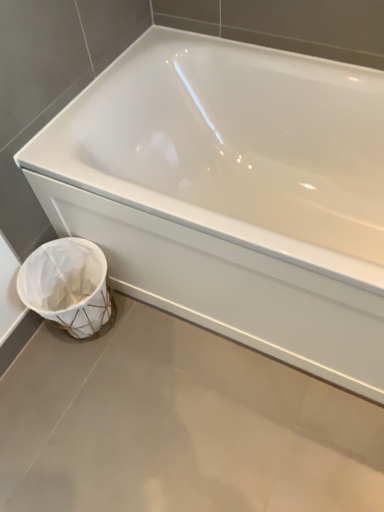
You are a GUI agent. You are given a task and a screenshot of the screen. Output one action in this format:
    pyautogui.click(x=<x>, y=<y>)
    Task: Click on the white glossy bathtub at lower left
    
    Given the screenshot: What is the action you would take?
    pyautogui.click(x=233, y=194)

The height and width of the screenshot is (512, 384). Describe the element at coordinates (233, 194) in the screenshot. I see `white glossy bathtub at lower left` at that location.

In order to face white glossy bathtub at lower left, should I rotate leftwards or rightwards?

Rotate right and turn 8.763 degrees.

Measure the distance between white woven basket at lower left and camera.

white woven basket at lower left is 1.15 meters away from camera.

Identify the location of white woven basket at lower left. This screenshot has width=384, height=512. (68, 285).

Image resolution: width=384 pixels, height=512 pixels. Describe the element at coordinates (68, 285) in the screenshot. I see `white woven basket at lower left` at that location.

Image resolution: width=384 pixels, height=512 pixels. Identify the location of white glossy bathtub at lower left. (233, 194).

Considering the positions of objects white glossy bathtub at lower left and white woven basket at lower left in the image provided, who is more to the left, white glossy bathtub at lower left or white woven basket at lower left?

white woven basket at lower left is more to the left.

Is the depth of white glossy bathtub at lower left less than that of white woven basket at lower left?

Yes, it is in front of white woven basket at lower left.

Which is less distant, (182, 283) or (111, 300)?

Point (182, 283) is closer to the camera than point (111, 300).

From the image's perspective, is white glossy bathtub at lower left located above or below white woven basket at lower left?

white glossy bathtub at lower left is above white woven basket at lower left.

From a real-world perspective, is white glossy bathtub at lower left located beneath white woven basket at lower left?

No, from a real-world perspective, white glossy bathtub at lower left is not below white woven basket at lower left.

Based on the photo, does white glossy bathtub at lower left have a lesser width compared to white woven basket at lower left?

In fact, white glossy bathtub at lower left might be wider than white woven basket at lower left.

Between white glossy bathtub at lower left and white woven basket at lower left, which one has less height?

white woven basket at lower left.

Can you confirm if white glossy bathtub at lower left is bigger than white woven basket at lower left?

Yes.

Is white glossy bathtub at lower left completely or partially outside of white woven basket at lower left?

Indeed, white glossy bathtub at lower left is completely outside white woven basket at lower left.

Is white glossy bathtub at lower left touching white woven basket at lower left?

No, white glossy bathtub at lower left is not next to white woven basket at lower left.

From the picture: Is white glossy bathtub at lower left turned away from white woven basket at lower left?

No, white glossy bathtub at lower left is not facing the opposite direction of white woven basket at lower left.

How many degrees apart are the facing directions of white glossy bathtub at lower left and white woven basket at lower left?

There is a 0.424-degree angle between the facing directions of white glossy bathtub at lower left and white woven basket at lower left.

Locate an element on the screen. The width and height of the screenshot is (384, 512). bathtub above the white woven basket at lower left (from the image's perspective) is located at coordinates (233, 194).

Considering the relative positions of white woven basket at lower left and white glossy bathtub at lower left in the image provided, is white woven basket at lower left to the left or to the right of white glossy bathtub at lower left?

From the image, it's evident that white woven basket at lower left is to the left of white glossy bathtub at lower left.

Is white woven basket at lower left positioned in front of white glossy bathtub at lower left?

No, white woven basket at lower left is behind white glossy bathtub at lower left.

Does point (74, 331) appear closer or farther from the camera than point (165, 197)?

Point (74, 331) is farther from the camera than point (165, 197).

From the picture: From the image's perspective, is white woven basket at lower left located beneath white glossy bathtub at lower left?

Yes, from the image's perspective, white woven basket at lower left is below white glossy bathtub at lower left.

From a real-world perspective, is white woven basket at lower left below white glossy bathtub at lower left?

Correct, in the physical world, white woven basket at lower left is lower than white glossy bathtub at lower left.

Can you confirm if white woven basket at lower left is wider than white glossy bathtub at lower left?

No.

Between white woven basket at lower left and white glossy bathtub at lower left, which one has more height?

Standing taller between the two is white glossy bathtub at lower left.

Who is smaller, white woven basket at lower left or white glossy bathtub at lower left?

white woven basket at lower left is smaller.

Is white woven basket at lower left situated inside white glossy bathtub at lower left or outside?

The correct answer is: outside.

Is white woven basket at lower left not close to white glossy bathtub at lower left?

No, white woven basket at lower left is not far from white glossy bathtub at lower left.

Is white woven basket at lower left oriented towards white glossy bathtub at lower left?

No, white woven basket at lower left is not turned towards white glossy bathtub at lower left.

How many degrees apart are the facing directions of white woven basket at lower left and white glossy bathtub at lower left?

0.424 degrees separate the facing orientations of white woven basket at lower left and white glossy bathtub at lower left.

From the picture: Measure the distance between white woven basket at lower left and white glossy bathtub at lower left.

white woven basket at lower left is 14.37 inches away from white glossy bathtub at lower left.

What are the coordinates of `bathtub in front of the white woven basket at lower left` in the screenshot? It's located at (233, 194).

This screenshot has height=512, width=384. I want to click on bathtub on the right of the white woven basket at lower left, so click(x=233, y=194).

Find the location of `toilet bowl lying on the left of white glossy bathtub at lower left`. toilet bowl lying on the left of white glossy bathtub at lower left is located at coordinates (68, 285).